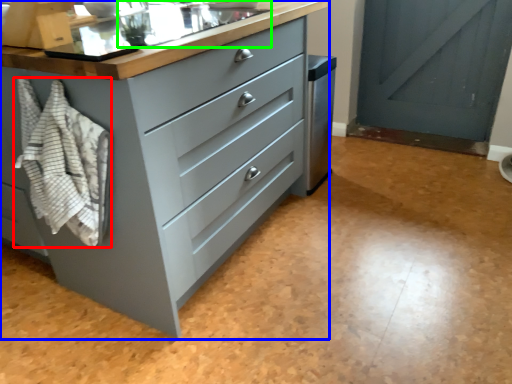
Question: Based on their relative distances, which object is farther from blanket (highlighted by a red box)? Choose from chest of drawers (highlighted by a blue box) and sink (highlighted by a green box).

Choices:
 (A) chest of drawers
 (B) sink

Answer: (B)